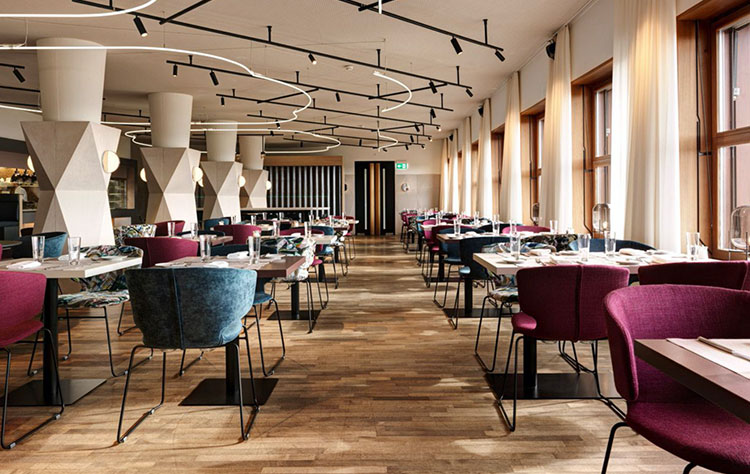
This screenshot has height=474, width=750. Find the location of `tables`. tables is located at coordinates tap(52, 286), tap(223, 364), tap(288, 292), tap(324, 259), tap(319, 237), tap(321, 219), tap(424, 209), tap(430, 220), tap(452, 232), tap(492, 258).